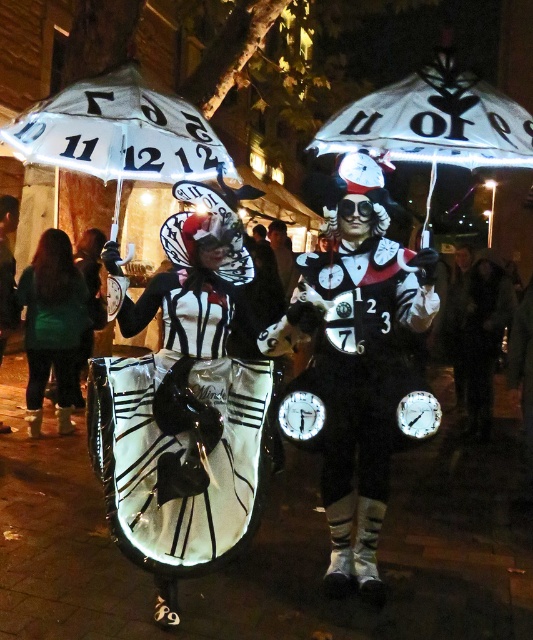
Locate an element on the screen. matte black fabric dress at center is located at coordinates (181, 436).

Does matte black fabric dress at center have a lesser width compared to white paper umbrella at upper left?

Correct, matte black fabric dress at center's width is less than white paper umbrella at upper left's.

What do you see at coordinates (181, 436) in the screenshot?
I see `matte black fabric dress at center` at bounding box center [181, 436].

Locate an element on the screen. The image size is (533, 640). matte black fabric dress at center is located at coordinates (181, 436).

Between white paper umbrella at upper left and green fabric jacket at lower left, which one has less height?

white paper umbrella at upper left

Between white paper umbrella at upper left and green fabric jacket at lower left, which one appears on the right side from the viewer's perspective?

Positioned to the right is white paper umbrella at upper left.

Between point (87, 115) and point (25, 280), which one is positioned behind?

Point (25, 280)

Find the location of a particular element. Image resolution: width=533 pixels, height=640 pixels. white paper umbrella at upper left is located at coordinates pyautogui.click(x=119, y=132).

Image resolution: width=533 pixels, height=640 pixels. What do you see at coordinates (119, 132) in the screenshot?
I see `white paper umbrella at upper left` at bounding box center [119, 132].

Does white paper umbrella at upper left have a lesser width compared to white paper umbrella at upper center?

No, white paper umbrella at upper left is not thinner than white paper umbrella at upper center.

In order to click on white paper umbrella at upper left in this screenshot , I will do `click(119, 132)`.

Identify the location of white paper umbrella at upper left. (119, 132).